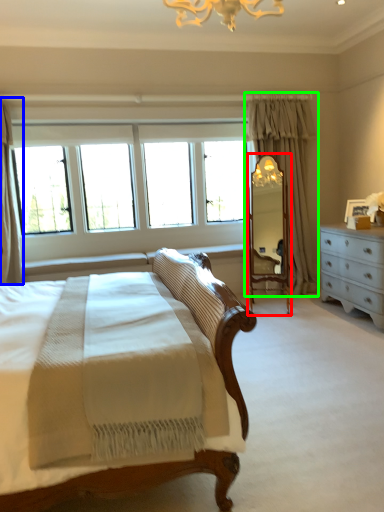
Question: Considering the real-world distances, which object is farthest from mirror (highlighted by a red box)? curtain (highlighted by a blue box) or curtain (highlighted by a green box)?

Choices:
 (A) curtain
 (B) curtain

Answer: (A)